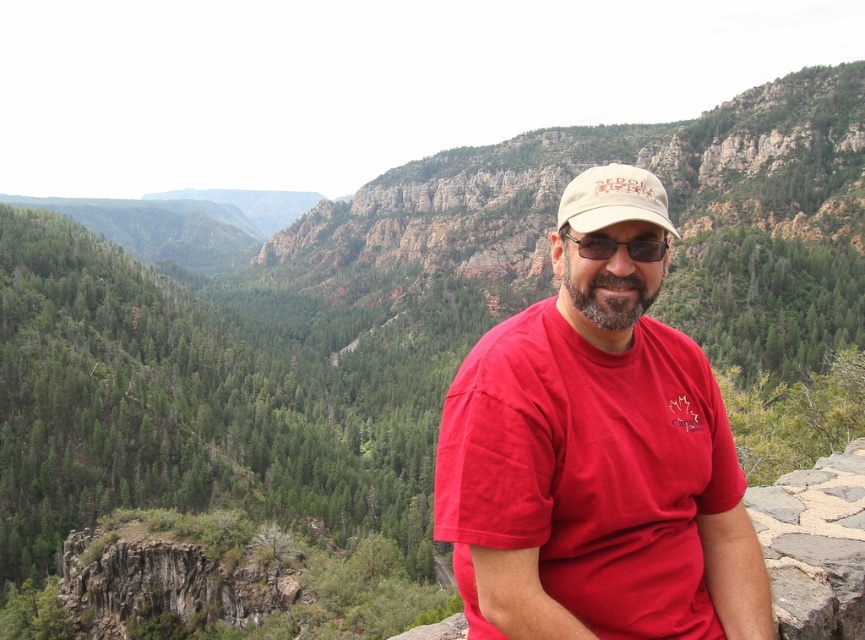
What color is the t shirt at the point (x=596, y=452)?

The t shirt at point (x=596, y=452) is matte red.

You are a photographer trying to capture the man in the scene. You notice a point at coordinates (596, 452). Based on the scene description, what object is this point located on?

The point at coordinates (596, 452) is located on the matte red t shirt at center.